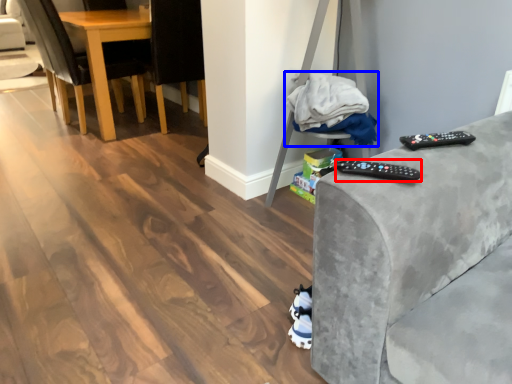
Question: Which of the following is the farthest to the observer, remote (highlighted by a red box) or material (highlighted by a blue box)?

Choices:
 (A) remote
 (B) material

Answer: (B)